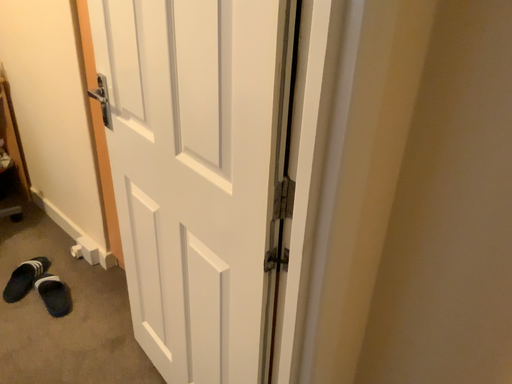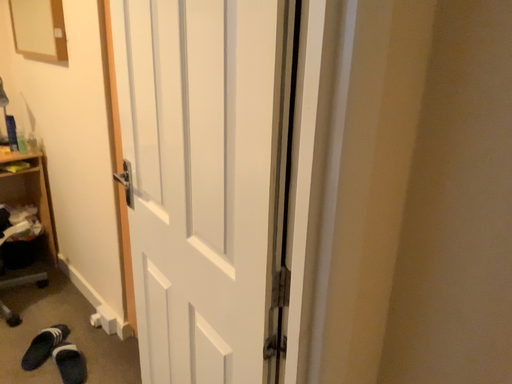
Question: How did the camera likely rotate when shooting the video?

Choices:
 (A) rotated upward
 (B) rotated downward

Answer: (A)